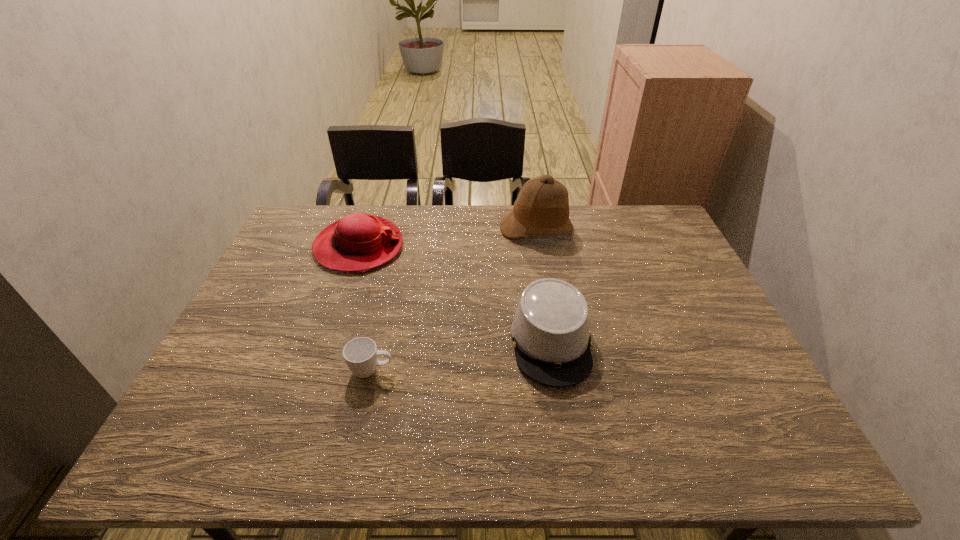
Image resolution: width=960 pixels, height=540 pixels. In the image, there is a desktop. In order to click on free space at the far edge in this screenshot , I will do `click(369, 211)`.

I want to click on vacant space at the near edge of the desktop, so click(x=311, y=453).

The height and width of the screenshot is (540, 960). I want to click on vacant space at the left edge of the desktop, so click(252, 328).

Where is `vacant space at the right edge of the desktop`? The image size is (960, 540). vacant space at the right edge of the desktop is located at coordinates (705, 313).

Where is `free space at the far left corner of the desktop`? free space at the far left corner of the desktop is located at coordinates (282, 239).

Locate an element on the screen. vacant space at the near left corner is located at coordinates (226, 426).

In the image, there is a desktop. Identify the location of free region at the far right corner. (653, 227).

Locate an element on the screen. free point between the shortest object and the tallest hat is located at coordinates (454, 300).

Identify the location of free spot between the cup and the tallest hat. The image size is (960, 540). (454, 300).

Where is `empty location between the leftmost hat and the tallest object`? This screenshot has height=540, width=960. empty location between the leftmost hat and the tallest object is located at coordinates (447, 238).